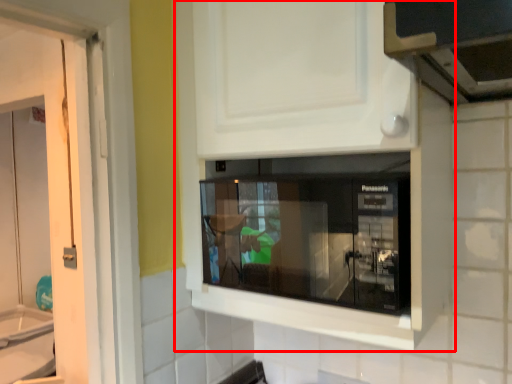
Question: From the image's perspective, considering the relative positions of cabinetry (annotated by the red box) and microwave oven in the image provided, where is cabinetry (annotated by the red box) located with respect to the staircase?

Choices:
 (A) above
 (B) below

Answer: (A)